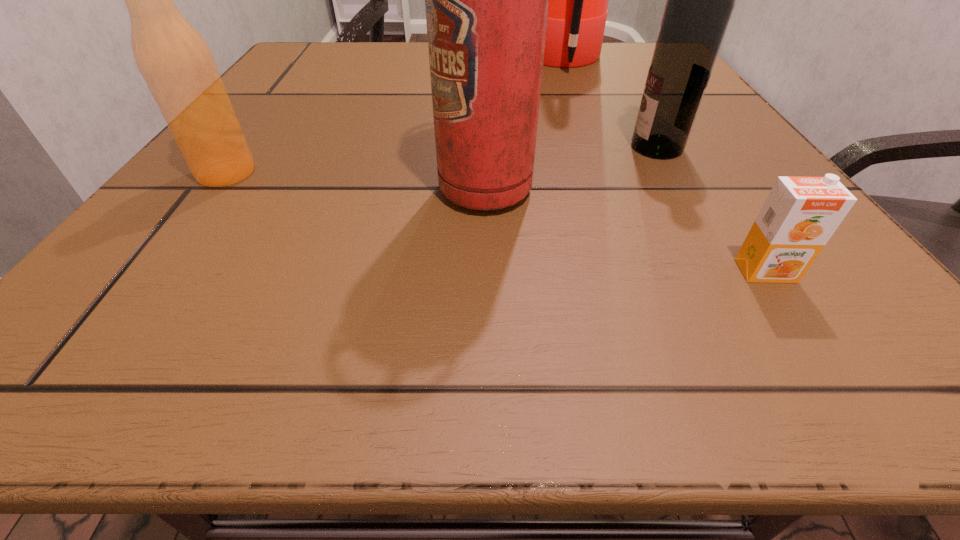
Choose which object is the nearest neighbor to the alcohol. Please provide its 2D coordinates. Your answer should be formatted as a tuple, i.e. [(x, y)], where the tuple contains the x and y coordinates of a point satisfying the conditions above.

[(486, 0)]

You are a GUI agent. You are given a task and a screenshot of the screen. Output one action in this format:
    pyautogui.click(x=<x>, y=<y>)
    Task: Click on the free point that satisfies the following two spatial constraints: 1. towards the nozzle of the farther fire extinguisher; 2. on the front side of the fourth tallest object
    
    Given the screenshot: What is the action you would take?
    pyautogui.click(x=605, y=172)

Locate an element on the screen. free space that satisfies the following two spatial constraints: 1. on the back side of the nearest object; 2. on the front and back of the third tallest object is located at coordinates [684, 147].

Locate an element on the screen. The image size is (960, 540). free space that satisfies the following two spatial constraints: 1. on the front and back of the alcohol; 2. on the front side of the beer bottle is located at coordinates (671, 172).

Where is `free space that satisfies the following two spatial constraints: 1. on the front and back of the alcohol; 2. on the back side of the shortest object`? The image size is (960, 540). free space that satisfies the following two spatial constraints: 1. on the front and back of the alcohol; 2. on the back side of the shortest object is located at coordinates (727, 271).

Locate an element on the screen. This screenshot has width=960, height=540. vacant space that satisfies the following two spatial constraints: 1. on the front side of the leftmost object; 2. on the left side of the shortest object is located at coordinates (153, 271).